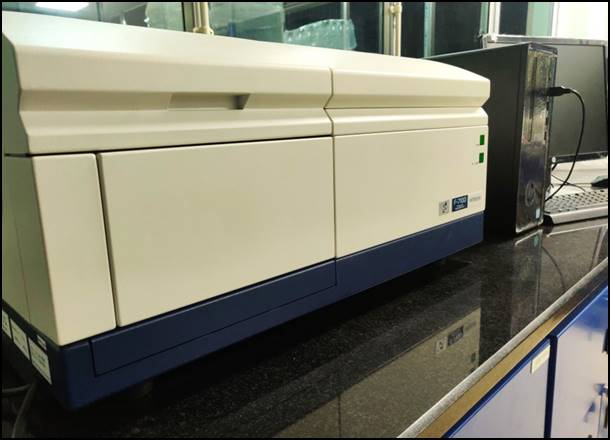
Identify the location of windows. [148, 13], [301, 13], [439, 13].